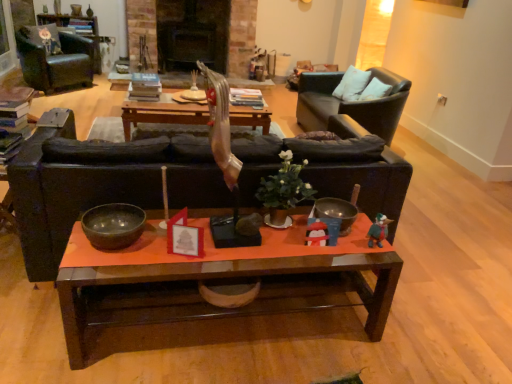
Image resolution: width=512 pixels, height=384 pixels. In order to click on free spot above metallic silver bowl at center, acting as the second bowl starting from the left (from a real-world perspective) in this screenshot , I will do `click(325, 212)`.